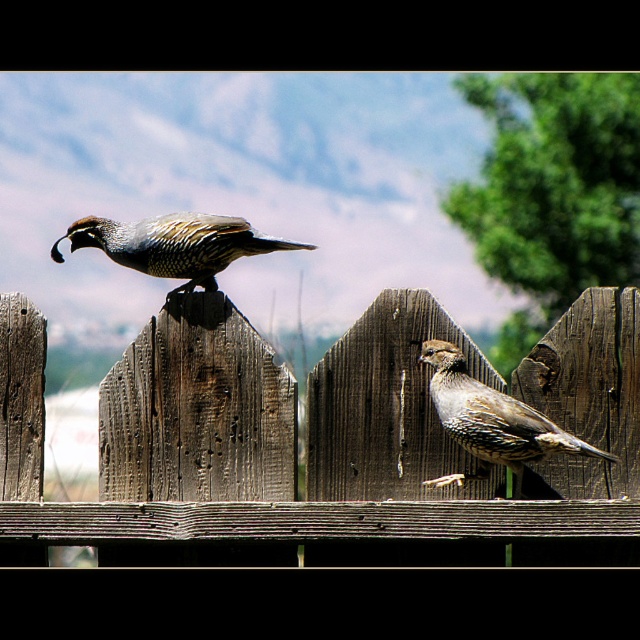
You are a birdwatcher trying to identify two quails on a fence. You notice the speckled feathered quail at center and the shiny brown quail at center. Which quail has a greater height?

The speckled feathered quail at center is much taller than the shiny brown quail at center, so the speckled feathered quail at center has a greater height.

You are a photographer trying to capture a clear shot of the speckled feathered quail at center. However, the weathered wood fence at center is blocking your view. Can you adjust your position to get a clear shot without moving the fence or the quail?

The weathered wood fence at center is closer to the viewer than the speckled feathered quail at center, so you can move your position to the side where the quail is not directly behind the fence to get a clear shot.

You are a birdwatcher trying to identify two quails on a fence. You notice the speckled feathered quail at center and the shiny brown quail at center. Which quail is located below the other?

The speckled feathered quail at center is positioned under the shiny brown quail at center, so the speckled one is below the shiny brown one.